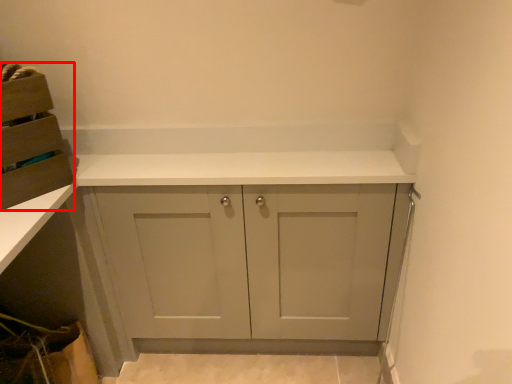
Question: In this image, where is cabinetry (annotated by the red box) located relative to cabinetry?

Choices:
 (A) right
 (B) left

Answer: (B)